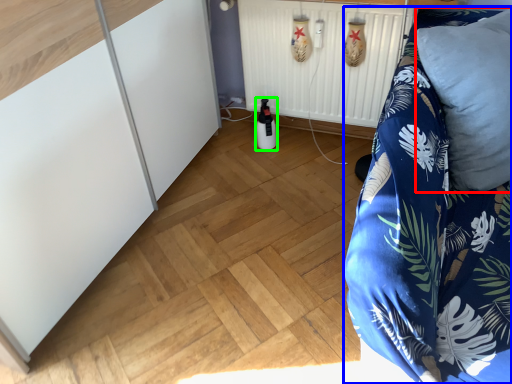
Question: Based on their relative distances, which object is nearer to pillow (highlighted by a red box)? Choose from furniture (highlighted by a blue box) and bottle (highlighted by a green box).

Choices:
 (A) furniture
 (B) bottle

Answer: (A)